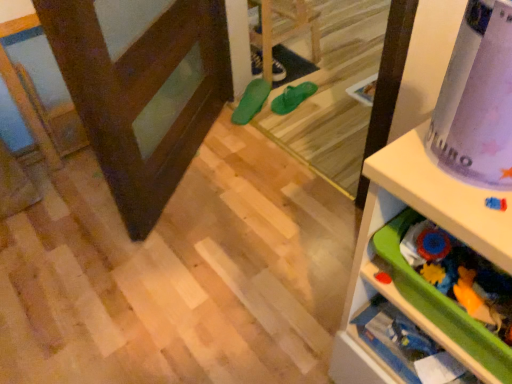
Question: Is green rubber shoe at center, the first footwear when ordered from front to back, closer to camera compared to green rubber flip-flops at center, which ranks as the 2th footwear in front-to-back order?

Choices:
 (A) no
 (B) yes

Answer: (B)

Question: Can you confirm if green rubber shoe at center, the first footwear when ordered from front to back, is positioned to the right of green rubber flip-flops at center, the 2th footwear positioned from the back?

Choices:
 (A) no
 (B) yes

Answer: (A)

Question: Is green rubber shoe at center, the first footwear when ordered from front to back, shorter than green rubber flip-flops at center, the 2th footwear positioned from the back?

Choices:
 (A) yes
 (B) no

Answer: (B)

Question: Is green rubber flip-flops at center, the 2th footwear positioned from the back, at the back of green rubber shoe at center, the first footwear when ordered from front to back?

Choices:
 (A) yes
 (B) no

Answer: (B)

Question: Does green rubber shoe at center, the first footwear when ordered from front to back, have a larger size compared to green rubber flip-flops at center, which ranks as the 2th footwear in front-to-back order?

Choices:
 (A) no
 (B) yes

Answer: (B)

Question: Considering the relative sizes of green rubber shoe at center, which appears as the third footwear when viewed from the back, and green rubber flip-flops at center, which ranks as the 2th footwear in front-to-back order, in the image provided, is green rubber shoe at center, which appears as the third footwear when viewed from the back, taller than green rubber flip-flops at center, which ranks as the 2th footwear in front-to-back order,?

Choices:
 (A) no
 (B) yes

Answer: (B)

Question: Does green rubber flip-flops at center, which ranks as the 2th footwear in front-to-back order, have a smaller size compared to dark brown wood screen door at left?

Choices:
 (A) yes
 (B) no

Answer: (A)

Question: Is green rubber flip-flops at center, which ranks as the 2th footwear in front-to-back order, placed right next to dark brown wood screen door at left?

Choices:
 (A) yes
 (B) no

Answer: (B)

Question: Is green rubber flip-flops at center, which ranks as the 2th footwear in front-to-back order, thinner than dark brown wood screen door at left?

Choices:
 (A) yes
 (B) no

Answer: (B)

Question: Is dark brown wood screen door at left at the back of green rubber flip-flops at center, the 2th footwear positioned from the back?

Choices:
 (A) no
 (B) yes

Answer: (B)

Question: Is green rubber flip-flops at center, which ranks as the 2th footwear in front-to-back order, behind dark brown wood screen door at left?

Choices:
 (A) yes
 (B) no

Answer: (A)

Question: Is green rubber flip-flops at center, which ranks as the 2th footwear in front-to-back order, not near dark brown wood screen door at left?

Choices:
 (A) no
 (B) yes

Answer: (A)

Question: From the image's perspective, is green rubber shoe at center, the first footwear when ordered from front to back, under dark brown wood screen door at left?

Choices:
 (A) yes
 (B) no

Answer: (B)